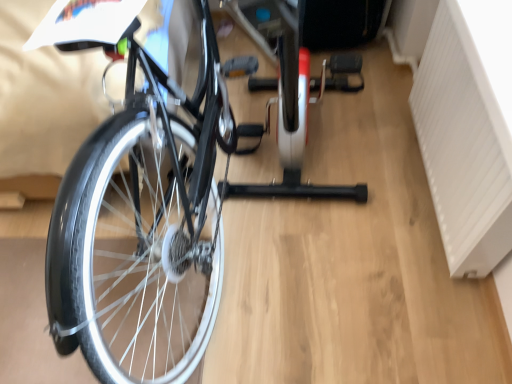
Locate an element on the screen. matte black bicycle at left is located at coordinates (150, 225).

What do you see at coordinates (150, 225) in the screenshot? I see `matte black bicycle at left` at bounding box center [150, 225].

The image size is (512, 384). Find the location of `matte black bicycle at left`. matte black bicycle at left is located at coordinates (150, 225).